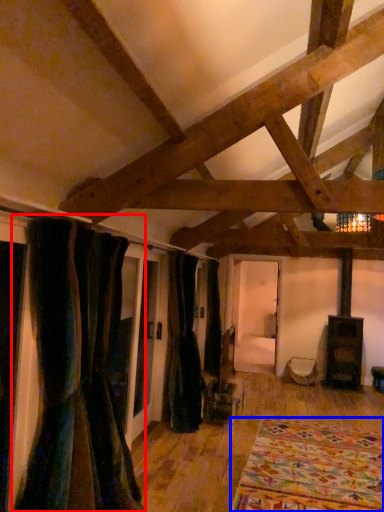
Question: Which object is further to the camera taking this photo, curtain (highlighted by a red box) or blanket (highlighted by a blue box)?

Choices:
 (A) curtain
 (B) blanket

Answer: (B)